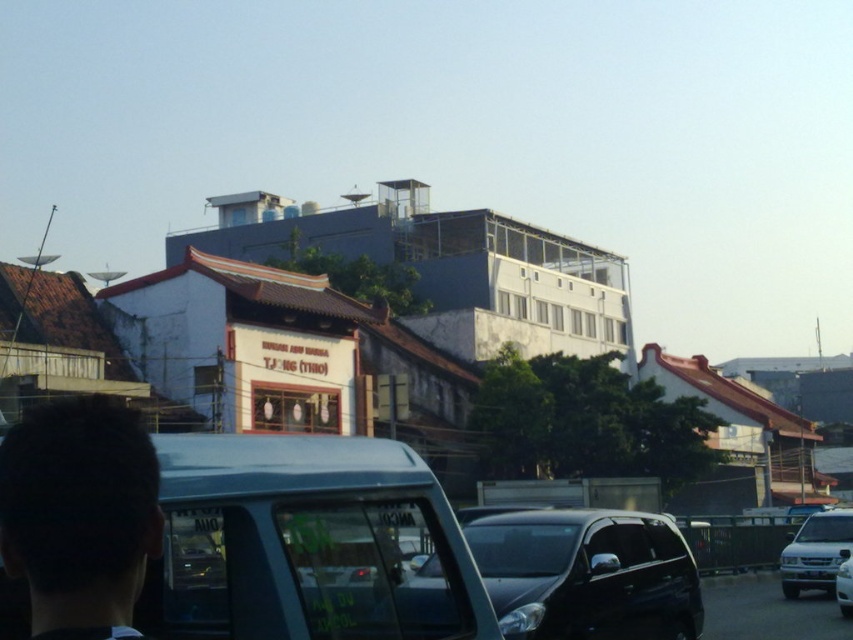
Question: Which point is farther to the camera?

Choices:
 (A) (131, 593)
 (B) (839, 536)
 (C) (846, 598)

Answer: (B)

Question: Among these points, which one is nearest to the camera?

Choices:
 (A) (811, 544)
 (B) (838, 593)

Answer: (B)

Question: Is black glossy car at center bigger than white glossy car at center?

Choices:
 (A) yes
 (B) no

Answer: (A)

Question: Observing the image, what is the correct spatial positioning of black glossy car at center in reference to white matte car at right?

Choices:
 (A) above
 (B) below

Answer: (A)

Question: Which object appears farthest from the camera in this image?

Choices:
 (A) dark hair at lower left
 (B) white matte car at right
 (C) white glossy car at center

Answer: (B)

Question: Can you confirm if black glossy car at center is positioned to the right of white matte car at right?

Choices:
 (A) yes
 (B) no

Answer: (B)